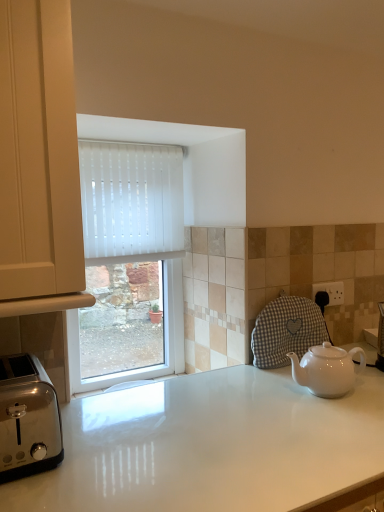
Describe the element at coordinates (212, 446) in the screenshot. This screenshot has width=384, height=512. I see `white glossy countertop at center` at that location.

What is the approximate height of white ceramic teapot at lower right?

white ceramic teapot at lower right is 5.67 inches tall.

This screenshot has height=512, width=384. What do you see at coordinates (327, 369) in the screenshot? I see `white ceramic teapot at lower right` at bounding box center [327, 369].

This screenshot has height=512, width=384. I want to click on polished stainless steel toaster at lower left, so click(28, 418).

From the image's perspective, is white glossy countertop at center above polished stainless steel toaster at lower left?

No.

Who is shorter, white glossy countertop at center or polished stainless steel toaster at lower left?

polished stainless steel toaster at lower left.

Which of these two, white glossy countertop at center or polished stainless steel toaster at lower left, is thinner?

polished stainless steel toaster at lower left.

From a real-world perspective, relative to polished stainless steel toaster at lower left, is white glossy countertop at center vertically above or below?

Clearly, from a real-world perspective, white glossy countertop at center is below polished stainless steel toaster at lower left.

Based on the photo, from the image's perspective, is white ceramic teapot at lower right above or below white glossy countertop at center?

white ceramic teapot at lower right is situated higher than white glossy countertop at center in the image.

Does white ceramic teapot at lower right lie behind white glossy countertop at center?

Yes, white ceramic teapot at lower right is further from the viewer.

Who is shorter, white ceramic teapot at lower right or white glossy countertop at center?

white ceramic teapot at lower right is shorter.

Is white ceramic teapot at lower right not close to white glossy countertop at center?

white ceramic teapot at lower right is near white glossy countertop at center, not far away.

From the image's perspective, is white ceramic teapot at lower right below polished stainless steel toaster at lower left?

No, from the image's perspective, white ceramic teapot at lower right is not beneath polished stainless steel toaster at lower left.

Considering the positions of objects white ceramic teapot at lower right and polished stainless steel toaster at lower left in the image provided, who is in front, white ceramic teapot at lower right or polished stainless steel toaster at lower left?

polished stainless steel toaster at lower left is in front.

Which is behind, point (341, 358) or point (18, 384)?

The point (341, 358) is behind.

Is white ceramic teapot at lower right placed right next to polished stainless steel toaster at lower left?

They are not placed beside each other.

Considering the sizes of objects white glossy countertop at center and white ceramic teapot at lower right in the image provided, who is wider, white glossy countertop at center or white ceramic teapot at lower right?

Wider between the two is white glossy countertop at center.

Is white glossy countertop at center taller than white ceramic teapot at lower right?

Indeed, white glossy countertop at center has a greater height compared to white ceramic teapot at lower right.

In the scene shown: Can white ceramic teapot at lower right be found inside white glossy countertop at center?

No.

Which is more to the left, white glossy countertop at center or white ceramic teapot at lower right?

white glossy countertop at center.

Is point (47, 409) behind point (107, 469)?

Yes, it is.

Between polished stainless steel toaster at lower left and white glossy countertop at center, which one has smaller size?

Smaller between the two is polished stainless steel toaster at lower left.

Is white glossy countertop at center at the back of polished stainless steel toaster at lower left?

polished stainless steel toaster at lower left does not have its back to white glossy countertop at center.

From a real-world perspective, is polished stainless steel toaster at lower left over white glossy countertop at center?

Correct, in the physical world, polished stainless steel toaster at lower left is higher than white glossy countertop at center.

From the image's perspective, would you say polished stainless steel toaster at lower left is shown under white ceramic teapot at lower right?

Yes, from the image's perspective, polished stainless steel toaster at lower left is beneath white ceramic teapot at lower right.

Can you confirm if polished stainless steel toaster at lower left is thinner than white ceramic teapot at lower right?

In fact, polished stainless steel toaster at lower left might be wider than white ceramic teapot at lower right.

How many degrees apart are the facing directions of polished stainless steel toaster at lower left and white ceramic teapot at lower right?

0.00997 degrees.

Where is `toaster that is below the white ceramic teapot at lower right (from the image's perspective)`? toaster that is below the white ceramic teapot at lower right (from the image's perspective) is located at coordinates pos(28,418).

The height and width of the screenshot is (512, 384). What are the coordinates of `toaster lying behind the white glossy countertop at center` in the screenshot? It's located at (28, 418).

This screenshot has width=384, height=512. Find the location of `countertop in front of the white ceramic teapot at lower right`. countertop in front of the white ceramic teapot at lower right is located at coordinates (212, 446).

Based on their spatial positions, is white glossy countertop at center or white ceramic teapot at lower right closer to polished stainless steel toaster at lower left?

The object closer to polished stainless steel toaster at lower left is white glossy countertop at center.

Estimate the real-world distances between objects in this image. Which object is closer to white glossy countertop at center, polished stainless steel toaster at lower left or white ceramic teapot at lower right?

white ceramic teapot at lower right is closer to white glossy countertop at center.

From the picture: Based on their spatial positions, is white ceramic teapot at lower right or white glossy countertop at center further from polished stainless steel toaster at lower left?

Among the two, white ceramic teapot at lower right is located further to polished stainless steel toaster at lower left.

Estimate the real-world distances between objects in this image. Which object is further from white ceramic teapot at lower right, white glossy countertop at center or polished stainless steel toaster at lower left?

polished stainless steel toaster at lower left lies further to white ceramic teapot at lower right than the other object.

In the scene shown: Which object lies further to the anchor point white ceramic teapot at lower right, polished stainless steel toaster at lower left or white glossy countertop at center?

polished stainless steel toaster at lower left is further to white ceramic teapot at lower right.

Based on their spatial positions, is white ceramic teapot at lower right or polished stainless steel toaster at lower left closer to white glossy countertop at center?

Based on the image, white ceramic teapot at lower right appears to be nearer to white glossy countertop at center.

Where is `countertop between polished stainless steel toaster at lower left and white ceramic teapot at lower right in the horizontal direction`? This screenshot has height=512, width=384. countertop between polished stainless steel toaster at lower left and white ceramic teapot at lower right in the horizontal direction is located at coordinates (212, 446).